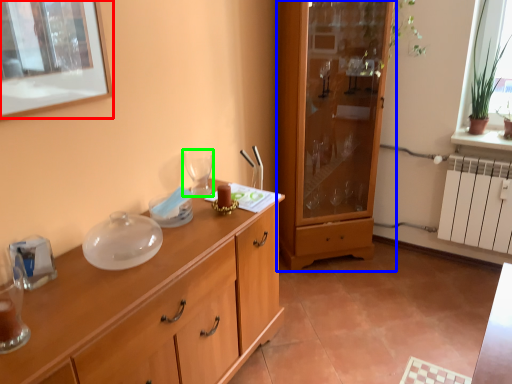
Question: Which object is positioned farthest from picture frame (highlighted by a red box)? Select from cabinetry (highlighted by a blue box) and wine glass (highlighted by a green box).

Choices:
 (A) cabinetry
 (B) wine glass

Answer: (A)